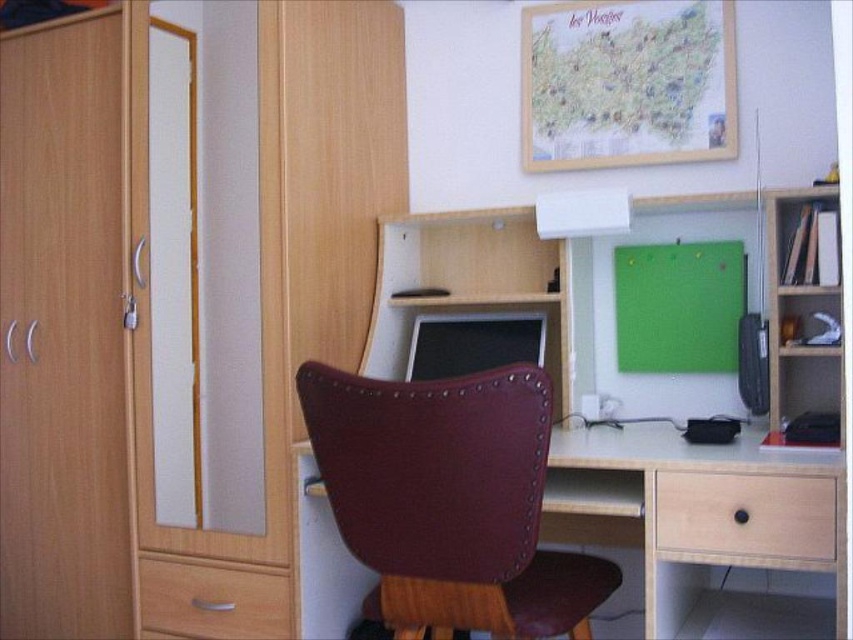
You are organizing your home office and want to place a new plant between the light brown wood drawer at lower right and the matte black monitor at center. Based on their positions, where should the plant be placed relative to the monitor?

The light brown wood drawer at lower right is below the matte black monitor at center, so the plant should be placed between them by positioning it below the matte black monitor at center and above the light brown wood drawer at lower right.

You are standing at the entrance of the office and want to sit in the leather chair. Which direction should you move to reach the leather chair located at point (450,500)?

The leather chair is located at point (450,500), so you should move towards the center of the room to reach it.